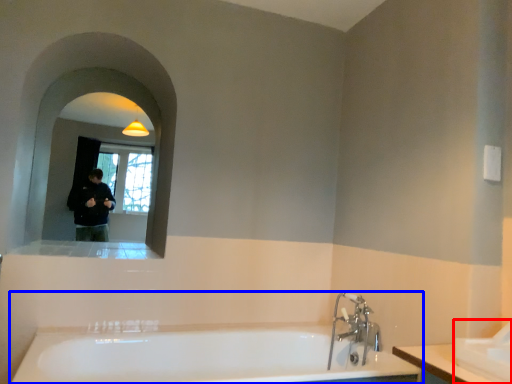
Question: Which of the following is the closest to the observer, sink (highlighted by a red box) or bathtub (highlighted by a blue box)?

Choices:
 (A) sink
 (B) bathtub

Answer: (A)